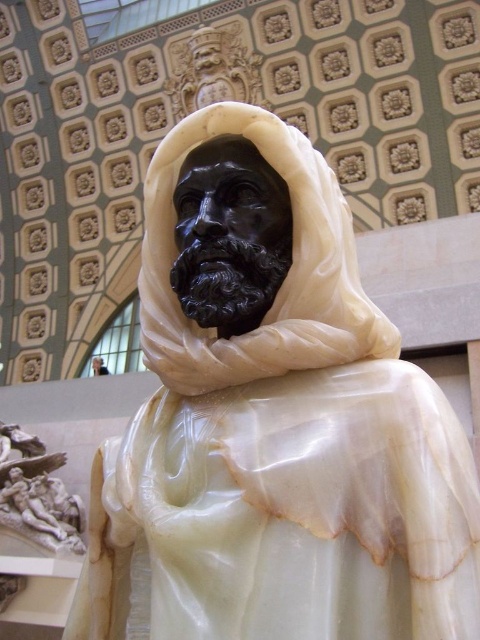
Question: Does black marble statue at center appear on the left side of white marble relief at lower left?

Choices:
 (A) no
 (B) yes

Answer: (A)

Question: Which object appears closest to the camera in this image?

Choices:
 (A) black marble statue at center
 (B) white marble relief at lower left

Answer: (A)

Question: Is black marble statue at center bigger than white marble relief at lower left?

Choices:
 (A) no
 (B) yes

Answer: (B)

Question: Is black marble statue at center below white marble relief at lower left?

Choices:
 (A) yes
 (B) no

Answer: (B)

Question: Which point is farther from the camera taking this photo?

Choices:
 (A) (338, 332)
 (B) (8, 488)

Answer: (B)